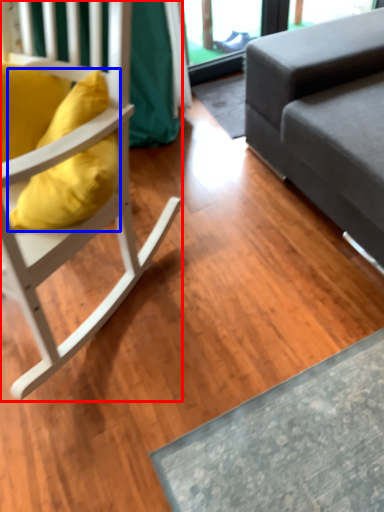
Question: Which object is closer to the camera taking this photo, chair (highlighted by a red box) or pillow (highlighted by a blue box)?

Choices:
 (A) chair
 (B) pillow

Answer: (A)